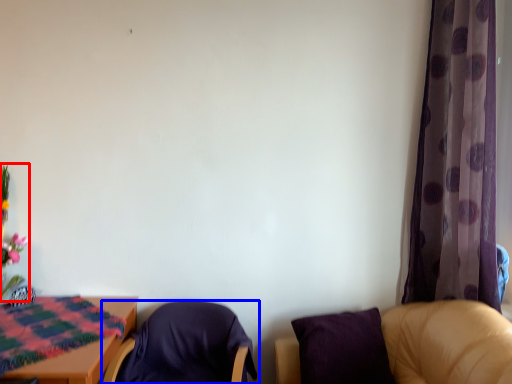
Question: Which of the following is the closest to the observer, floral arrangement (highlighted by a red box) or chair (highlighted by a blue box)?

Choices:
 (A) floral arrangement
 (B) chair

Answer: (B)